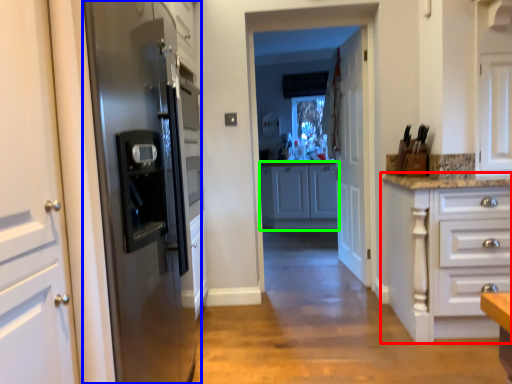
Question: Based on their relative distances, which object is nearer to cabinetry (highlighted by a red box)? Choose from refrigerator (highlighted by a blue box) and cabinetry (highlighted by a green box).

Choices:
 (A) refrigerator
 (B) cabinetry

Answer: (A)